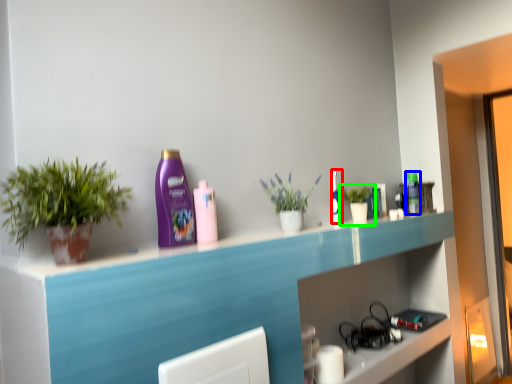
Question: Estimate the real-world distances between objects in this image. Which object is farther from mouthwash (highlighted by a red box), mouthwash (highlighted by a blue box) or houseplant (highlighted by a green box)?

Choices:
 (A) mouthwash
 (B) houseplant

Answer: (A)